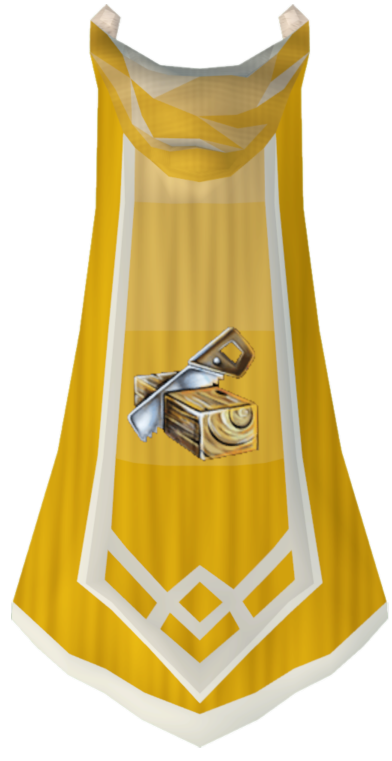
In order to click on yellow drape in this screenshot , I will do `click(194, 537)`.